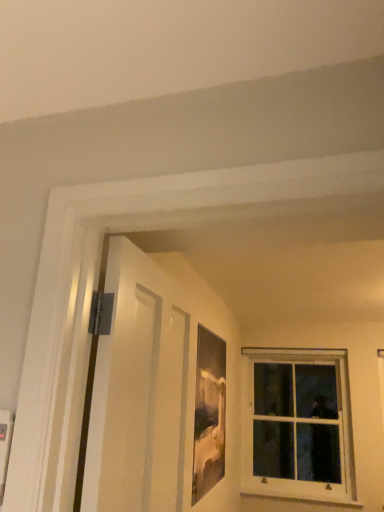
Question: Can you confirm if white matte door at left is taller than white wood window at upper right?

Choices:
 (A) no
 (B) yes

Answer: (A)

Question: Is white matte door at left aimed at white wood window at upper right?

Choices:
 (A) yes
 (B) no

Answer: (B)

Question: Does white matte door at left have a lesser height compared to white wood window at upper right?

Choices:
 (A) yes
 (B) no

Answer: (A)

Question: Is white matte door at left to the left of white wood window at upper right from the viewer's perspective?

Choices:
 (A) yes
 (B) no

Answer: (A)

Question: Are white matte door at left and white wood window at upper right located far from each other?

Choices:
 (A) no
 (B) yes

Answer: (B)

Question: Would you say white matte door at left is outside white wood window at upper right?

Choices:
 (A) no
 (B) yes

Answer: (B)

Question: Is white wood window at upper right not close to matte wooden picture frame at center?

Choices:
 (A) yes
 (B) no

Answer: (A)

Question: Considering the relative positions of white wood window at upper right and matte wooden picture frame at center in the image provided, is white wood window at upper right behind matte wooden picture frame at center?

Choices:
 (A) yes
 (B) no

Answer: (A)

Question: Does white wood window at upper right come in front of matte wooden picture frame at center?

Choices:
 (A) no
 (B) yes

Answer: (A)

Question: Does white wood window at upper right have a larger size compared to matte wooden picture frame at center?

Choices:
 (A) no
 (B) yes

Answer: (B)

Question: Considering the relative sizes of white wood window at upper right and matte wooden picture frame at center in the image provided, is white wood window at upper right thinner than matte wooden picture frame at center?

Choices:
 (A) no
 (B) yes

Answer: (A)

Question: From the image's perspective, would you say white wood window at upper right is positioned over matte wooden picture frame at center?

Choices:
 (A) no
 (B) yes

Answer: (A)

Question: Is matte wooden picture frame at center facing away from white wood window at upper right?

Choices:
 (A) yes
 (B) no

Answer: (B)